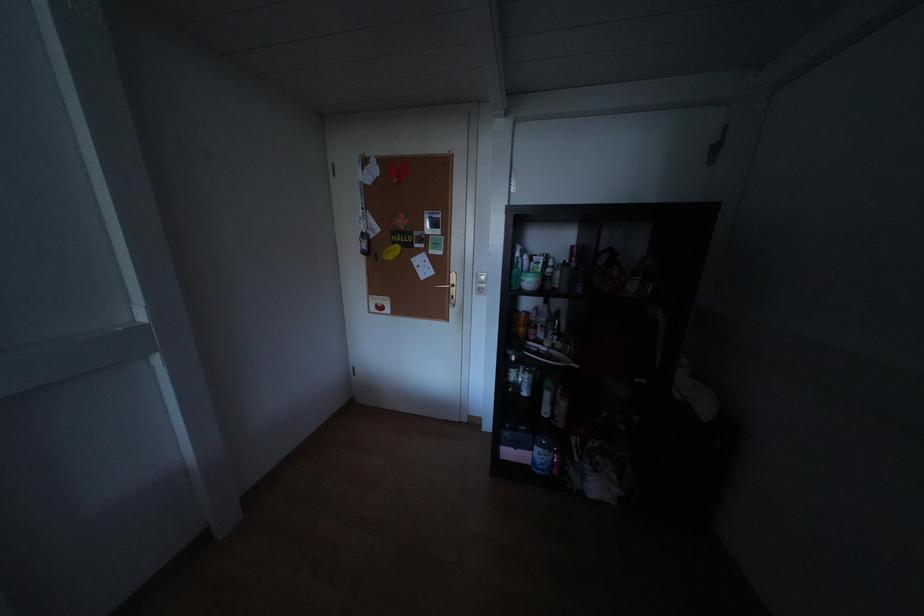
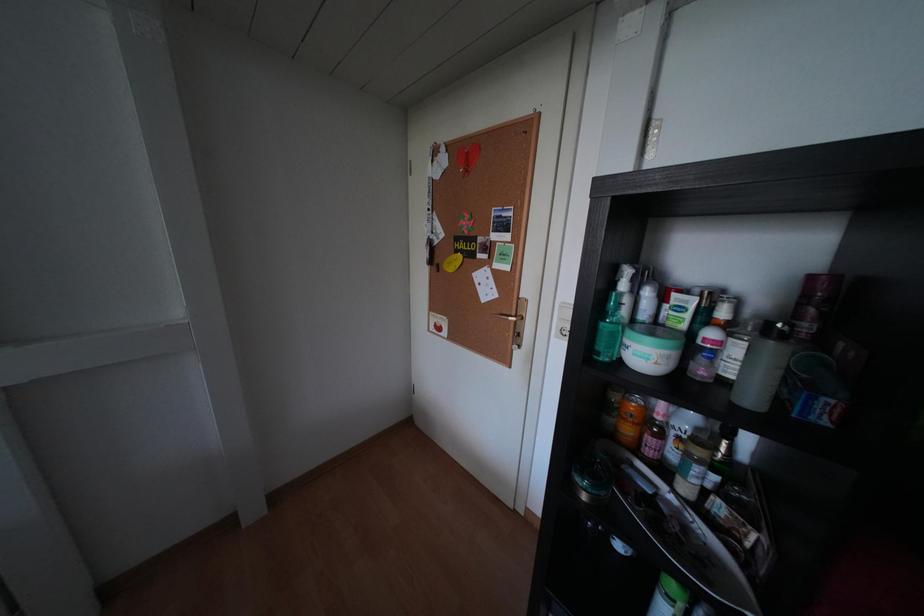
Question: The images are taken continuously from a first-person perspective. In which direction is your viewpoint rotating?

Choices:
 (A) Left
 (B) Right
 (C) Up
 (D) Down

Answer: (A)